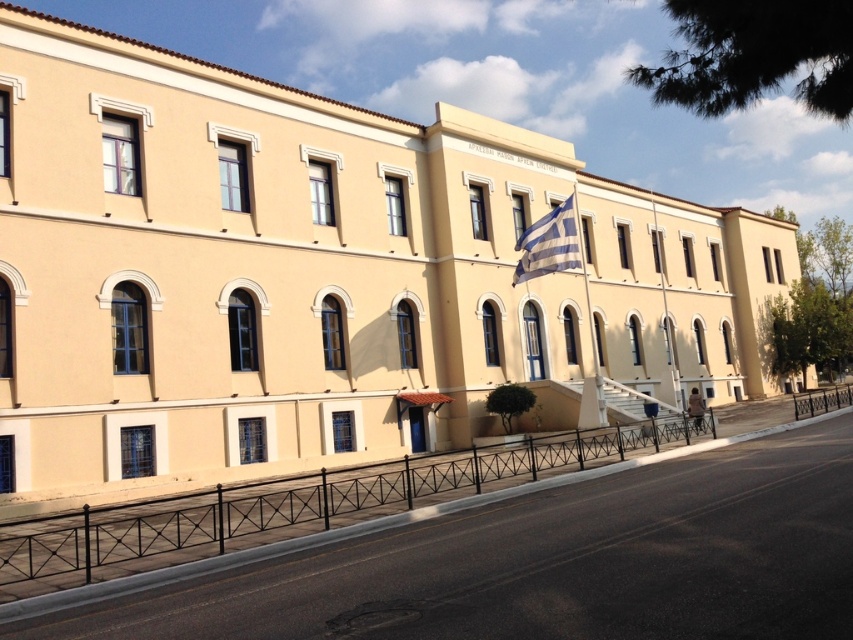
Question: Does white fabric flag at center come in front of black wrought iron railing at center?

Choices:
 (A) no
 (B) yes

Answer: (A)

Question: Is black metal fence at lower center to the left of white fabric flag at center from the viewer's perspective?

Choices:
 (A) no
 (B) yes

Answer: (B)

Question: Among these objects, which one is nearest to the camera?

Choices:
 (A) black metal fence at lower center
 (B) white fabric flag at center
 (C) black wrought iron railing at center

Answer: (A)

Question: Estimate the real-world distances between objects in this image. Which object is closer to the black wrought iron railing at center?

Choices:
 (A) black metal fence at lower center
 (B) white fabric flag at center

Answer: (B)

Question: Which point is farther to the camera?

Choices:
 (A) (822, 401)
 (B) (547, 444)
 (C) (575, 220)

Answer: (A)

Question: Does black metal fence at lower center lie in front of black wrought iron railing at center?

Choices:
 (A) yes
 (B) no

Answer: (A)